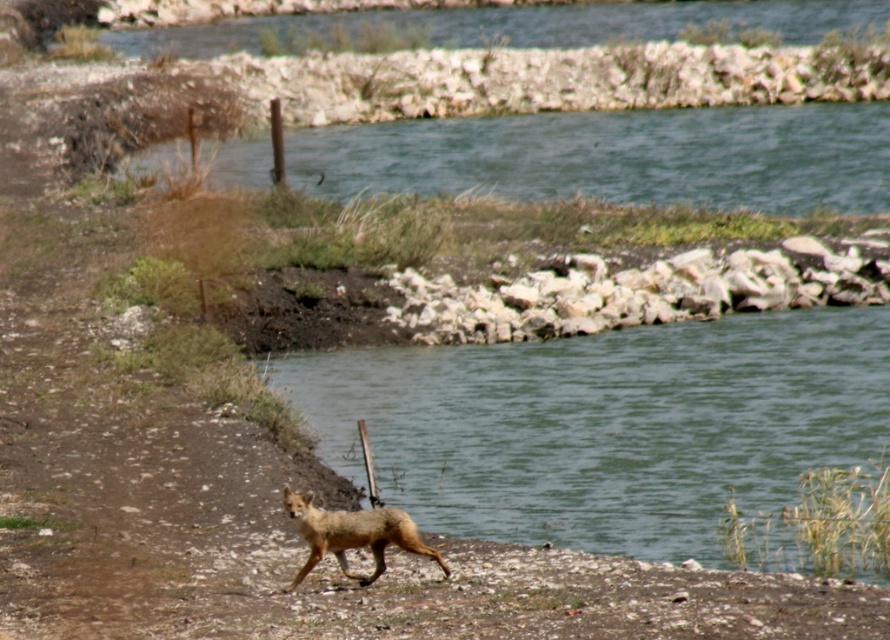
This screenshot has width=890, height=640. What do you see at coordinates (608, 422) in the screenshot? I see `green water at center` at bounding box center [608, 422].

Is point (522, 417) positioned before point (309, 524)?

No, (522, 417) is further to viewer.

Where is `green water at center`? The width and height of the screenshot is (890, 640). green water at center is located at coordinates (608, 422).

From the picture: Does green water at center have a greater width compared to greenish-blue water at upper center?

No, green water at center is not wider than greenish-blue water at upper center.

Between point (791, 326) and point (563, 138), which one is positioned in front?

Point (791, 326) is more forward.

Identify the location of green water at center. Image resolution: width=890 pixels, height=640 pixels. (608, 422).

Does point (541, 156) come closer to viewer compared to point (346, 541)?

No, (541, 156) is behind (346, 541).

Who is lower down, greenish-blue water at upper center or fur-like golden coyote at lower center?

fur-like golden coyote at lower center

Does point (688, 109) come behind point (338, 563)?

That is True.

You are a GUI agent. You are given a task and a screenshot of the screen. Output one action in this format:
    pyautogui.click(x=<x>, y=<y>)
    Task: Click on the greenish-blue water at upper center
    The width and height of the screenshot is (890, 640).
    Given the screenshot: What is the action you would take?
    pyautogui.click(x=619, y=156)